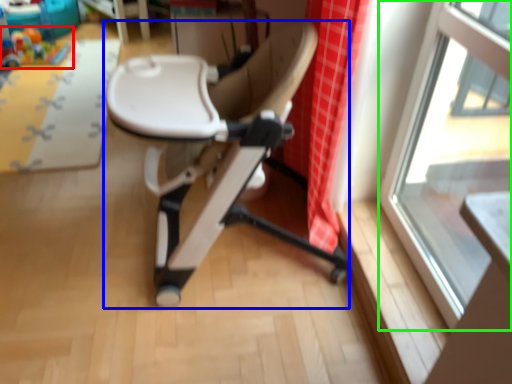
Question: Considering the real-world distances, which object is farthest from toy (highlighted by a red box)? chair (highlighted by a blue box) or window (highlighted by a green box)?

Choices:
 (A) chair
 (B) window

Answer: (B)